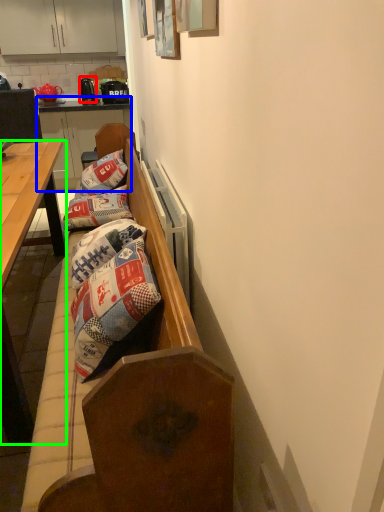
Question: Estimate the real-world distances between objects in this image. Which object is farther from kitchen appliance (highlighted by a red box), dresser (highlighted by a blue box) or desk (highlighted by a green box)?

Choices:
 (A) dresser
 (B) desk

Answer: (B)